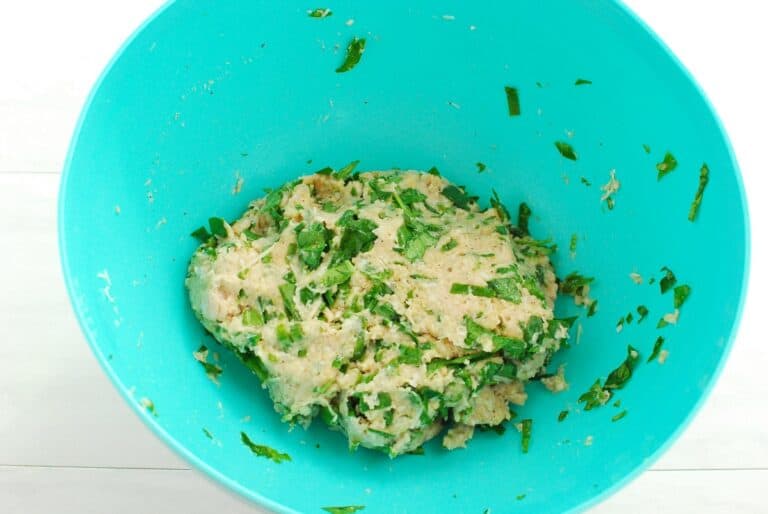
Where is `left rim of the blue bowl`? left rim of the blue bowl is located at coordinates (55, 226).